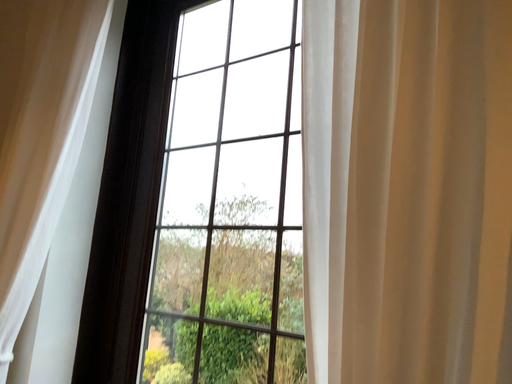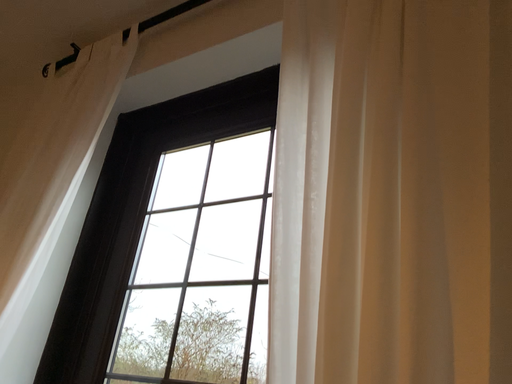
Question: Which way did the camera rotate in the video?

Choices:
 (A) rotated downward
 (B) rotated upward

Answer: (B)